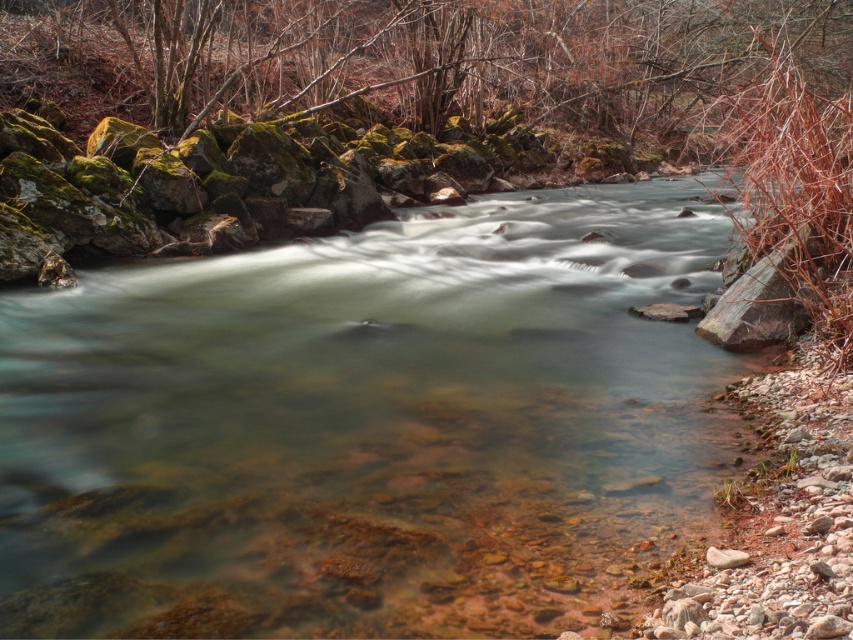
Question: Is clear water at center thinner than green mossy rock at upper center?

Choices:
 (A) yes
 (B) no

Answer: (A)

Question: Does clear water at center lie behind green mossy rock at upper center?

Choices:
 (A) yes
 (B) no

Answer: (B)

Question: Can you confirm if clear water at center is positioned below green mossy rock at upper center?

Choices:
 (A) no
 (B) yes

Answer: (B)

Question: Which of the following is the closest to the observer?

Choices:
 (A) (631, 534)
 (B) (598, 61)

Answer: (A)

Question: Which point is farther to the camera?

Choices:
 (A) clear water at center
 (B) green mossy rock at upper center

Answer: (B)